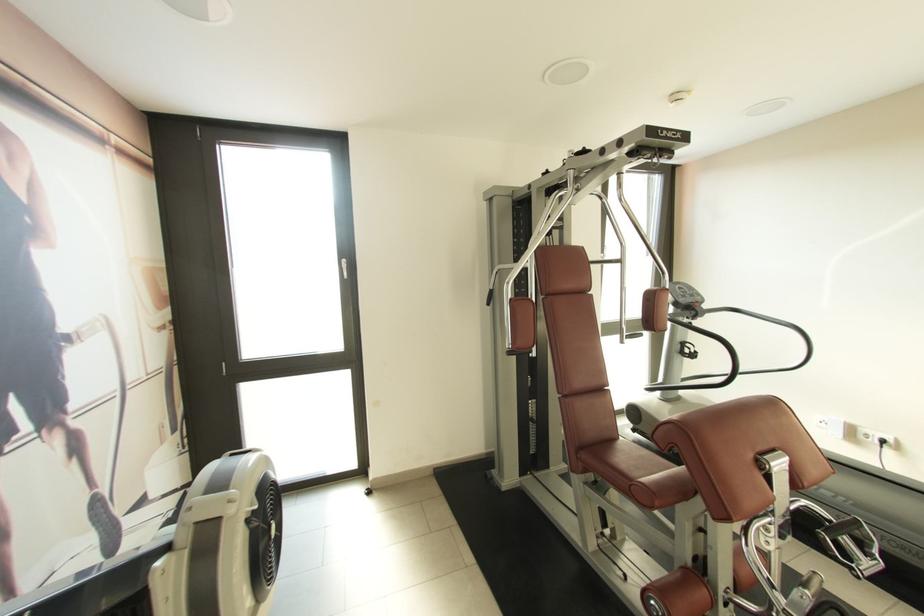
The image size is (924, 616). What do you see at coordinates (344, 268) in the screenshot?
I see `the white door handle` at bounding box center [344, 268].